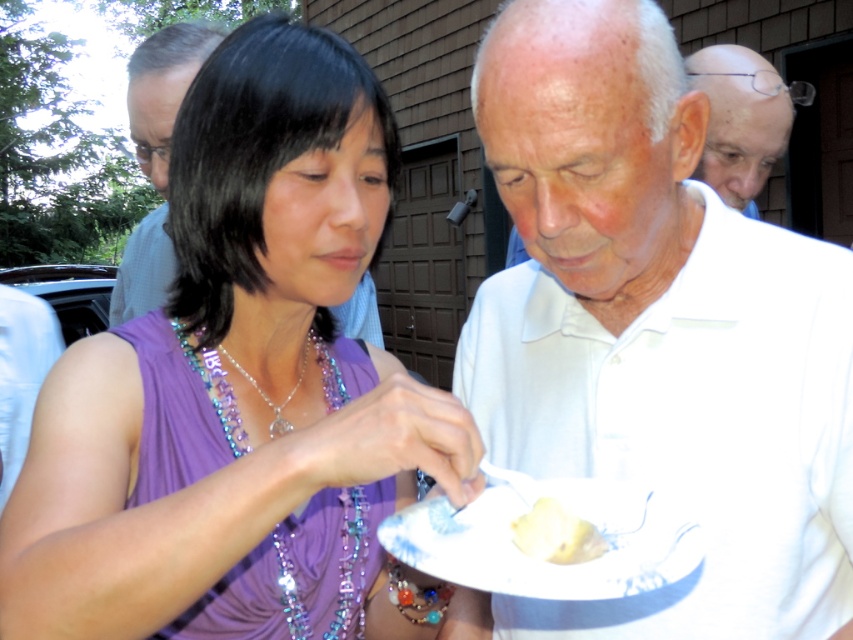
Based on the photo, you are at a social gathering and see the gray fabric shirt at upper left and the yellow matte paper at lower center. Which object is closer to you?

The gray fabric shirt at upper left is closer to you because it is further to the viewer than the yellow matte paper at lower center.

You are organizing a picnic and need to decide whether to use the gray fabric shirt at upper left or the yellow matte paper at lower center to cover a basket. Which item would be more suitable for covering a basket based on their sizes?

The gray fabric shirt at upper left is larger in size than the yellow matte paper at lower center, so it would be more suitable for covering a basket since it can provide better coverage.